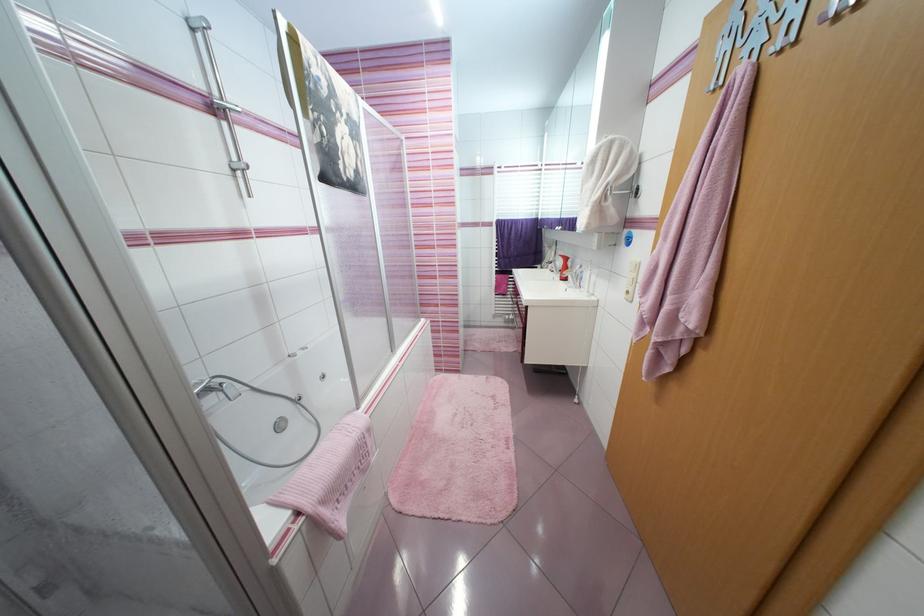
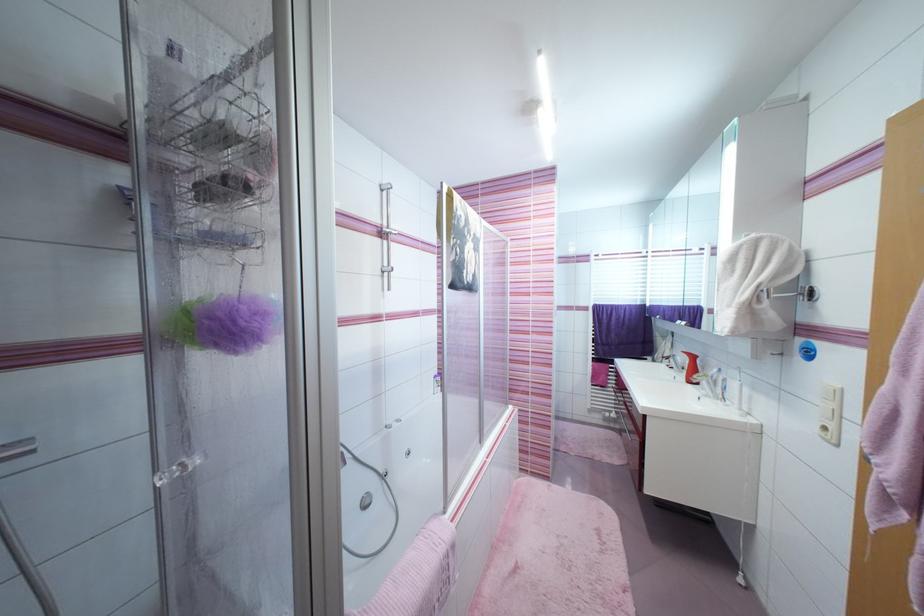
Locate, in the second image, the point that corresponds to the point at 592,207 in the first image.

(735, 307)